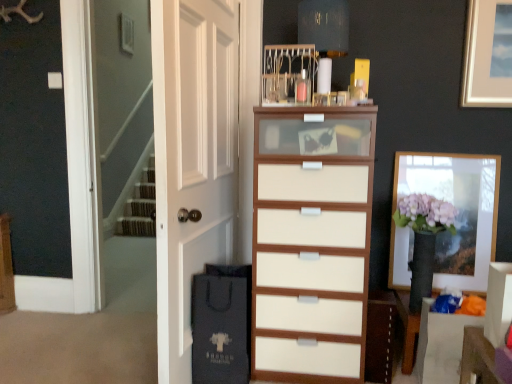
What is the approximate width of white wood chest of drawers at center?

white wood chest of drawers at center is 25.69 inches in width.

The image size is (512, 384). In order to click on wooden picture frame at right in this screenshot , I will do `click(458, 211)`.

Describe the element at coordinates (458, 211) in the screenshot. I see `wooden picture frame at right` at that location.

Find the location of a particular element. This screenshot has width=512, height=384. white matte door at center is located at coordinates (192, 159).

The image size is (512, 384). I want to click on white wood chest of drawers at center, so click(311, 242).

Is white glossy drawer at lower right surrounding white wood chest of drawers at center?

No, white wood chest of drawers at center is not surrounded by white glossy drawer at lower right.

Relative to white wood chest of drawers at center, is white glossy drawer at lower right in front or behind?

white glossy drawer at lower right is positioned farther from the viewer than white wood chest of drawers at center.

Between point (431, 340) and point (356, 287), which one is positioned behind?

The point (356, 287) is behind.

Is white glossy drawer at lower right bigger or smaller than white wood chest of drawers at center?

In the image, white glossy drawer at lower right appears to be smaller than white wood chest of drawers at center.

Considering the relative sizes of white wood chest of drawers at center and white wood cabinet at center in the image provided, is white wood chest of drawers at center thinner than white wood cabinet at center?

No.

From a real-world perspective, is white wood chest of drawers at center under white wood cabinet at center?

No, from a real-world perspective, white wood chest of drawers at center is not beneath white wood cabinet at center.

Is white wood chest of drawers at center in contact with white wood cabinet at center?

No, white wood chest of drawers at center is not making contact with white wood cabinet at center.

Would you say white wood cabinet at center is a long distance from white wood chest of drawers at center?

Result: white wood cabinet at center is actually quite close to white wood chest of drawers at center.

From the image's perspective, is white wood cabinet at center above or below white wood chest of drawers at center?

white wood cabinet at center is situated lower than white wood chest of drawers at center in the image.

Considering the relative sizes of white wood cabinet at center and white wood chest of drawers at center in the image provided, is white wood cabinet at center smaller than white wood chest of drawers at center?

Yes, white wood cabinet at center is smaller than white wood chest of drawers at center.

In the scene shown: Is white wood cabinet at center completely or partially outside of white wood chest of drawers at center?

Yes, white wood cabinet at center is not within white wood chest of drawers at center.

Is wooden picture frame at right positioned far away from white wood cabinet at center?

No, wooden picture frame at right is in close proximity to white wood cabinet at center.

Measure the distance between wooden picture frame at right and white wood cabinet at center.

wooden picture frame at right is 56.92 centimeters from white wood cabinet at center.

Between wooden picture frame at right and white wood cabinet at center, which one is positioned behind?

wooden picture frame at right is further away from the camera.

In the scene shown: Could you tell me if wooden picture frame at right is facing white wood cabinet at center?

Yes, wooden picture frame at right faces towards white wood cabinet at center.

You are a GUI agent. You are given a task and a screenshot of the screen. Output one action in this format:
    pyautogui.click(x=<x>, y=<y>)
    Task: Click on the shopping bag located above the white wood cabinet at center (from a real-world perspective)
    Image resolution: width=512 pixels, height=384 pixels.
    Given the screenshot: What is the action you would take?
    pyautogui.click(x=221, y=324)

Is white wood cabinet at center in contact with matte black shopping bag at lower left?

No, white wood cabinet at center is not touching matte black shopping bag at lower left.

Is point (390, 379) closer or farther from the camera than point (194, 332)?

Point (390, 379) is positioned farther from the camera compared to point (194, 332).

From a real-world perspective, relative to matte black shopping bag at lower left, is white wood cabinet at center vertically above or below?

white wood cabinet at center is situated lower than matte black shopping bag at lower left in the real world.

I want to click on shopping bag below the white wood chest of drawers at center (from a real-world perspective), so click(221, 324).

From a real-world perspective, which object rests below the other?

matte black shopping bag at lower left, from a real-world perspective.

Is matte black shopping bag at lower left situated inside white wood chest of drawers at center or outside?

matte black shopping bag at lower left is located beyond the bounds of white wood chest of drawers at center.

Measure the distance between matte black shopping bag at lower left and white wood chest of drawers at center.

The distance of matte black shopping bag at lower left from white wood chest of drawers at center is 27.20 centimeters.

Does white wood cabinet at center have a lesser width compared to white matte door at center?

Yes, white wood cabinet at center is thinner than white matte door at center.

Does point (386, 292) appear closer or farther from the camera than point (234, 187)?

Clearly, point (386, 292) is closer to the camera than point (234, 187).

Is the surface of white wood cabinet at center in direct contact with white matte door at center?

There is a gap between white wood cabinet at center and white matte door at center.

There is a white glossy drawer at lower right. At what (x,y) coordinates should I click in order to perform the action: click on the chest of drawers above it (from a real-world perspective). Please return your answer as a coordinate pair (x, y). The height and width of the screenshot is (384, 512). Looking at the image, I should click on (311, 242).

In order to click on cabinetry that is under the white wood chest of drawers at center (from a real-world perspective) in this screenshot , I will do `click(380, 336)`.

Based on their spatial positions, is wooden picture frame at right or white glossy drawer at lower right closer to matte black shopping bag at lower left?

white glossy drawer at lower right is positioned closer to the anchor matte black shopping bag at lower left.

Looking at the image, which one is located further to white matte door at center, white wood cabinet at center or white glossy drawer at lower right?

white glossy drawer at lower right is further to white matte door at center.

Considering their positions, is wooden picture frame at right positioned further to matte black shopping bag at lower left than white matte door at center?

The object further to matte black shopping bag at lower left is wooden picture frame at right.

Estimate the real-world distances between objects in this image. Which object is closer to matte black shopping bag at lower left, white matte door at center or wooden picture frame at right?

white matte door at center is positioned closer to the anchor matte black shopping bag at lower left.

Considering their positions, is white matte door at center positioned further to wooden picture frame at right than white glossy drawer at lower right?

white matte door at center is further to wooden picture frame at right.

When comparing their distances from wooden picture frame at right, does white wood chest of drawers at center or white glossy drawer at lower right seem further?

Based on the image, white wood chest of drawers at center appears to be further to wooden picture frame at right.

From the picture: Which object lies nearer to the anchor point white wood cabinet at center, wooden picture frame at right or white glossy drawer at lower right?

white glossy drawer at lower right is positioned closer to the anchor white wood cabinet at center.

Estimate the real-world distances between objects in this image. Which object is further from white wood chest of drawers at center, white wood cabinet at center or wooden picture frame at right?

wooden picture frame at right lies further to white wood chest of drawers at center than the other object.

This screenshot has width=512, height=384. Find the location of `cabinetry located between white matte door at center and wooden picture frame at right in the left-right direction`. cabinetry located between white matte door at center and wooden picture frame at right in the left-right direction is located at coordinates (380, 336).

Image resolution: width=512 pixels, height=384 pixels. Find the location of `the chest of drawers situated between white matte door at center and wooden picture frame at right from left to right`. the chest of drawers situated between white matte door at center and wooden picture frame at right from left to right is located at coordinates (311, 242).

The width and height of the screenshot is (512, 384). Identify the location of shopping bag situated between white matte door at center and white glossy drawer at lower right from left to right. (221, 324).

Identify the location of vanity between matte black shopping bag at lower left and wooden picture frame at right. (441, 345).